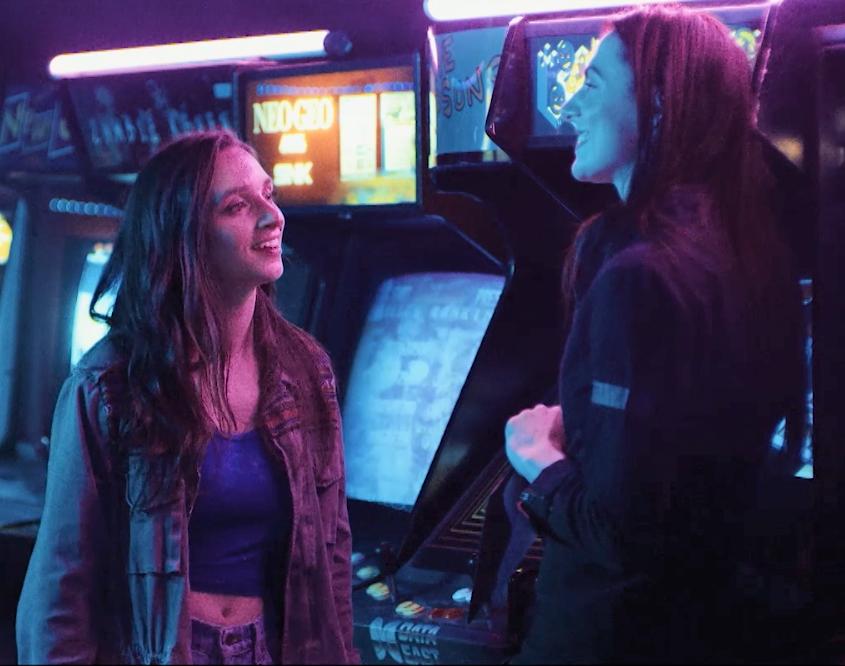
Where is `light`? The image size is (845, 666). light is located at coordinates (205, 42).